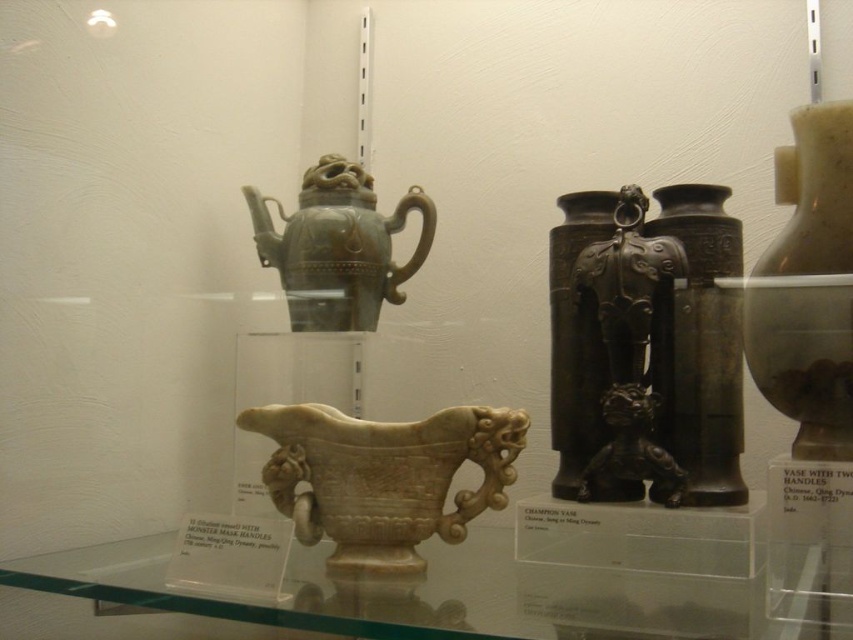
Looking at this image, is bronze elephant at center bigger than green jade teapot at center?

Yes.

Can you confirm if bronze elephant at center is positioned to the left of green jade teapot at center?

In fact, bronze elephant at center is to the right of green jade teapot at center.

Is point (650, 445) less distant than point (370, 310)?

Yes, point (650, 445) is in front of point (370, 310).

Where is `bronze elephant at center`? The height and width of the screenshot is (640, 853). bronze elephant at center is located at coordinates click(x=612, y=349).

Which is below, bronze elephant at center or white marble cup at center?

white marble cup at center is below.

Identify the location of bronze elephant at center. This screenshot has width=853, height=640. (612, 349).

Locate an element on the screen. The image size is (853, 640). bronze elephant at center is located at coordinates (612, 349).

Does matte brown vase at upper right have a lesser width compared to green jade teapot at center?

Yes, matte brown vase at upper right is thinner than green jade teapot at center.

Who is higher up, matte brown vase at upper right or green jade teapot at center?

green jade teapot at center

Which is in front, point (796, 147) or point (369, 241)?

Positioned in front is point (796, 147).

Where is `matte brown vase at upper right`? The image size is (853, 640). matte brown vase at upper right is located at coordinates (804, 364).